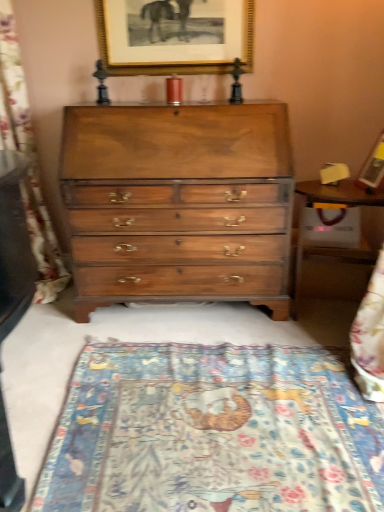
At what (x,y) coordinates should I click in order to perform the action: click on free space in front of wooden table at right. Please return your answer as a coordinate pair (x, y). The image size is (384, 512). Looking at the image, I should click on (307, 354).